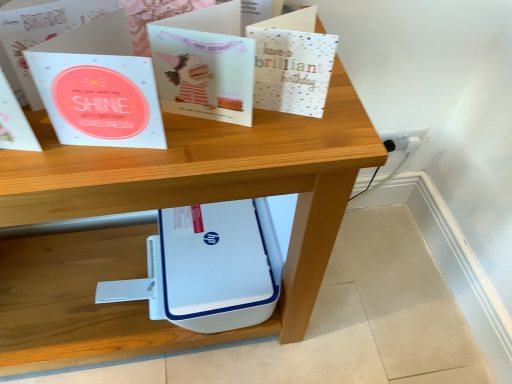
Question: Is white plastic socket at lower right outside of metallic silver card at upper center, which appears as the first paperback book when viewed from the right?

Choices:
 (A) no
 (B) yes

Answer: (B)

Question: Could you tell me if white plastic socket at lower right is facing metallic silver card at upper center, which is the third paperback book in left-to-right order?

Choices:
 (A) yes
 (B) no

Answer: (B)

Question: Is white plastic socket at lower right taller than metallic silver card at upper center, which is the third paperback book in left-to-right order?

Choices:
 (A) yes
 (B) no

Answer: (B)

Question: From the image's perspective, would you say white plastic socket at lower right is shown under metallic silver card at upper center, which is the third paperback book in left-to-right order?

Choices:
 (A) yes
 (B) no

Answer: (A)

Question: Considering the relative sizes of white plastic socket at lower right and metallic silver card at upper center, which is the third paperback book in left-to-right order, in the image provided, is white plastic socket at lower right thinner than metallic silver card at upper center, which is the third paperback book in left-to-right order,?

Choices:
 (A) yes
 (B) no

Answer: (A)

Question: Is white plastic socket at lower right further to camera compared to metallic silver card at upper center, which is the third paperback book in left-to-right order?

Choices:
 (A) no
 (B) yes

Answer: (B)

Question: From a real-world perspective, is white plastic printer at center on top of white plastic socket at lower right?

Choices:
 (A) no
 (B) yes

Answer: (B)

Question: Is white plastic printer at center not within white plastic socket at lower right?

Choices:
 (A) yes
 (B) no

Answer: (A)

Question: Is white plastic printer at center touching white plastic socket at lower right?

Choices:
 (A) no
 (B) yes

Answer: (A)

Question: Is white plastic socket at lower right at the back of white plastic printer at center?

Choices:
 (A) yes
 (B) no

Answer: (B)

Question: Considering the relative positions of white plastic printer at center and white plastic socket at lower right in the image provided, is white plastic printer at center in front of white plastic socket at lower right?

Choices:
 (A) no
 (B) yes

Answer: (B)

Question: Can you confirm if white plastic printer at center is positioned to the left of white plastic socket at lower right?

Choices:
 (A) yes
 (B) no

Answer: (A)

Question: Considering the relative sizes of matte paper card at center, acting as the second paperback book starting from the left, and light blue paper at center, which is the 1th paperback book in left-to-right order, in the image provided, is matte paper card at center, acting as the second paperback book starting from the left, shorter than light blue paper at center, which is the 1th paperback book in left-to-right order,?

Choices:
 (A) yes
 (B) no

Answer: (A)